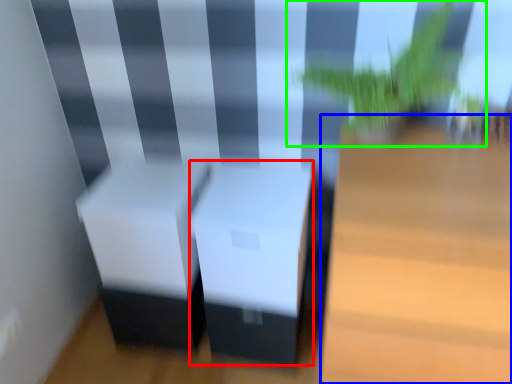
Question: Considering the real-world distances, which object is farthest from table (highlighted by a red box)? table (highlighted by a blue box) or houseplant (highlighted by a green box)?

Choices:
 (A) table
 (B) houseplant

Answer: (B)